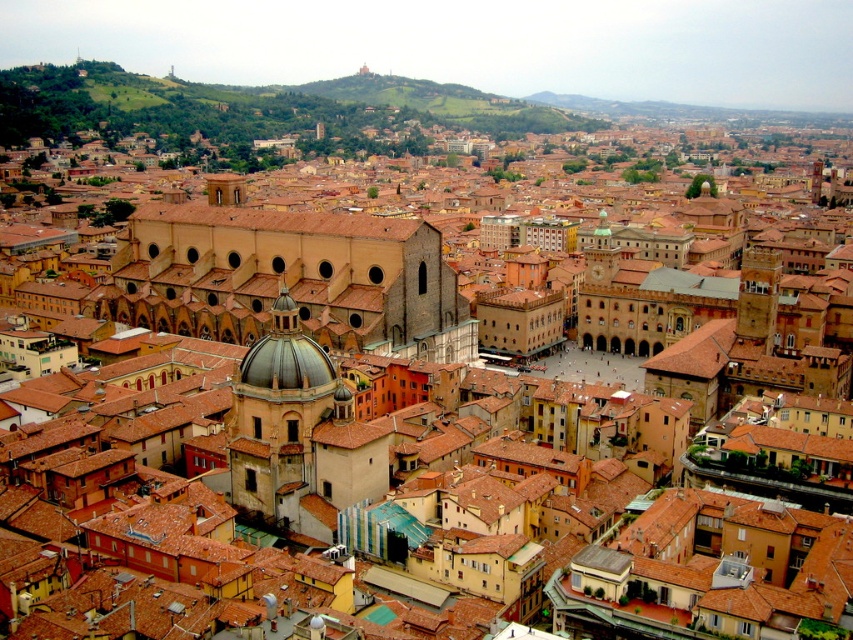
Question: Which of the following is the closest to the observer?

Choices:
 (A) metallic dome at center
 (B) brown tile roof at center

Answer: (A)

Question: Can you confirm if metallic dome at center is wider than brown tile roof at center?

Choices:
 (A) yes
 (B) no

Answer: (B)

Question: Which object is farther from the camera taking this photo?

Choices:
 (A) brown tile roof at center
 (B) metallic dome at center

Answer: (A)

Question: Which point is farther to the camera?

Choices:
 (A) (308, 234)
 (B) (230, 468)

Answer: (A)

Question: Observing the image, what is the correct spatial positioning of metallic dome at center in reference to brown tile roof at center?

Choices:
 (A) left
 (B) right

Answer: (B)

Question: Is metallic dome at center to the left of brown tile roof at center from the viewer's perspective?

Choices:
 (A) no
 (B) yes

Answer: (A)